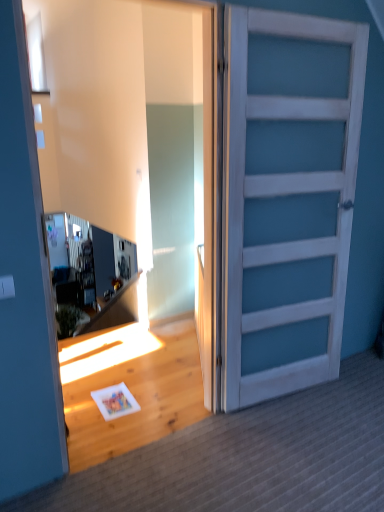
This screenshot has width=384, height=512. Identify the location of free location to the right of white wooden door at right. (350, 392).